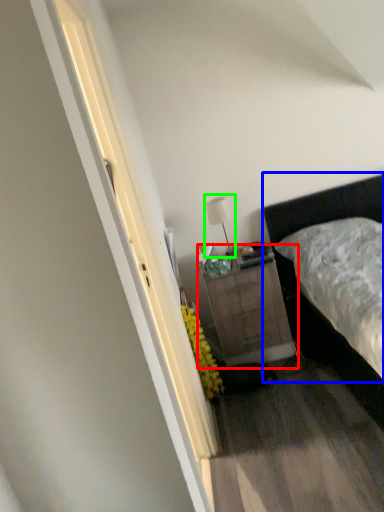
Question: Which is nearer to the nightstand (highlighted by a red box)? bed (highlighted by a blue box) or table lamp (highlighted by a green box).

Choices:
 (A) bed
 (B) table lamp

Answer: (A)